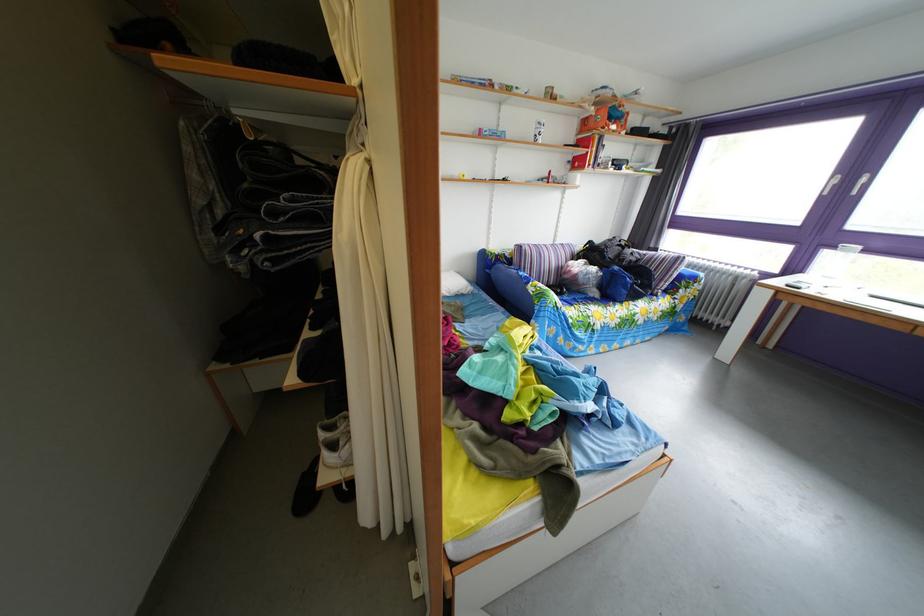
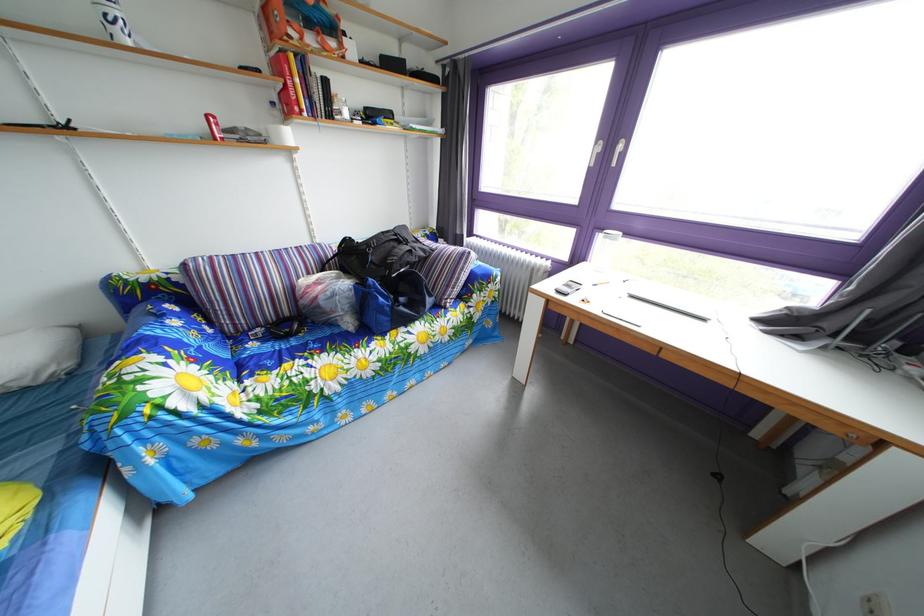
Where in the second image is the point corresponding to pixel 579 169 from the first image?

(284, 111)